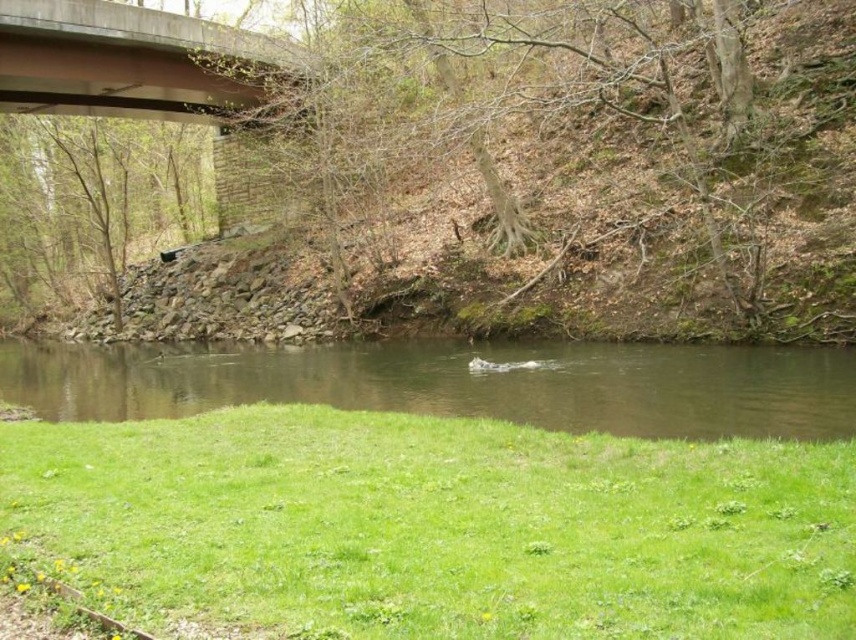
You are standing at the camera position and want to place a 10 feet long wooden board on the ground to reach the green grass at lower center. Will the board be long enough to reach it?

The green grass at lower center is 13.21 feet away from the camera. The wooden board is only 10 feet long, so it will not be long enough to reach the green grass at lower center.

You are standing at the center of the image and want to walk to the green grass at lower center. Based on the coordinates provided, which direction should you move to reach it?

The green grass at lower center is located at coordinates point (438, 525). Since you are at the center, you should move downward and to the right to reach it.

You are standing on the green grass at lower center and want to reach the concrete at upper center. Which direction should you move to get there?

You should move upward because the green grass at lower center is located below the concrete at upper center.